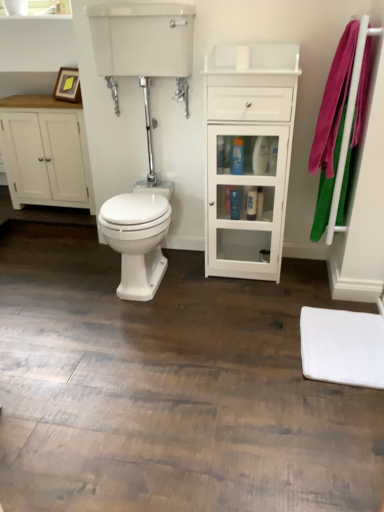
Where is `free space in front of white glossy bidet at center`? Image resolution: width=384 pixels, height=512 pixels. free space in front of white glossy bidet at center is located at coordinates (x=134, y=328).